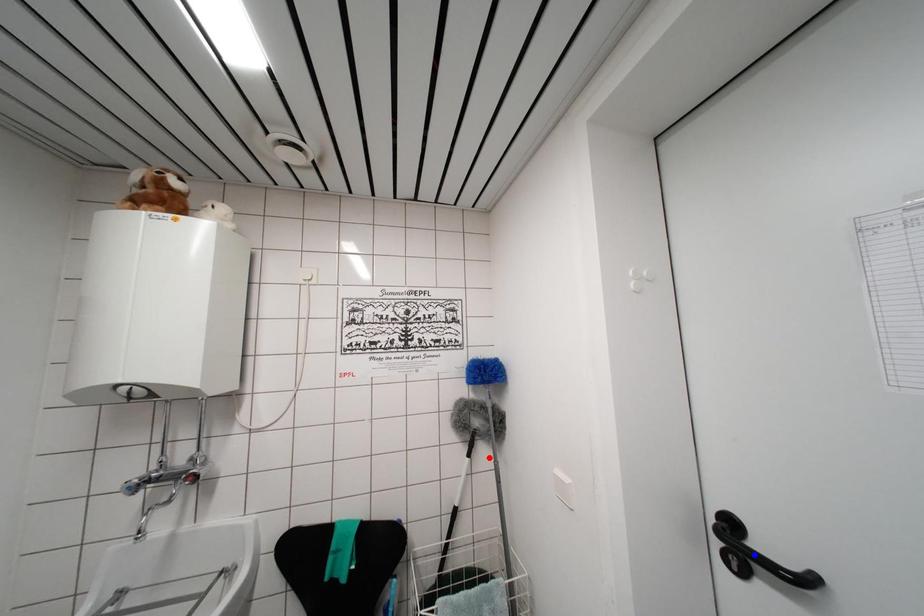
Question: In the image, two points are highlighted. Which point is nearer to the camera? Reply with the corresponding letter.

Choices:
 (A) blue point
 (B) red point

Answer: (A)